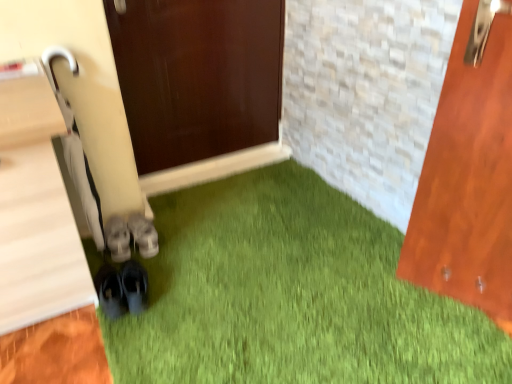
Question: Relative to gray suede shoes at center, which appears as the 1th footwear when viewed from the back, is black matte shoes at lower left, the first footwear viewed from the front, in front or behind?

Choices:
 (A) behind
 (B) front

Answer: (B)

Question: Choose the correct answer: Is black matte shoes at lower left, the first footwear viewed from the front, inside gray suede shoes at center, arranged as the third footwear when viewed from the front, or outside it?

Choices:
 (A) outside
 (B) inside

Answer: (A)

Question: Which object is the closest to the white leather sneakers at center, the 2th footwear from the front?

Choices:
 (A) black matte shoes at lower left, the first footwear viewed from the front
 (B) gray suede shoes at center, which appears as the 1th footwear when viewed from the back

Answer: (B)

Question: Which of these objects is positioned closest to the gray suede shoes at center, which appears as the 1th footwear when viewed from the back?

Choices:
 (A) black matte shoes at lower left, marked as the third footwear in a back-to-front arrangement
 (B) white leather sneakers at center, the 2th footwear viewed from the back

Answer: (B)